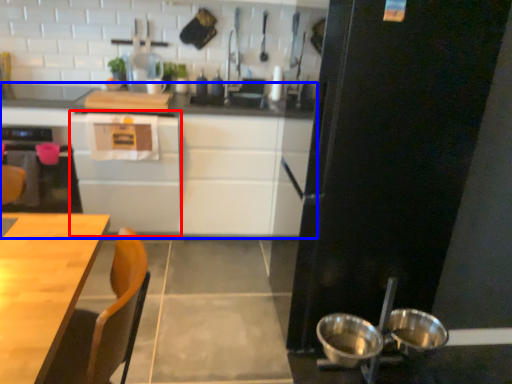
Question: Which of the following is the closest to the observer, cabinetry (highlighted by a red box) or cabinetry (highlighted by a blue box)?

Choices:
 (A) cabinetry
 (B) cabinetry

Answer: (A)